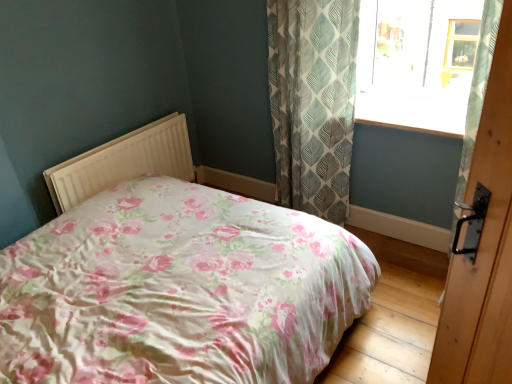
Question: Does transparent glass window at upper right have a lesser height compared to green leaf-patterned fabric curtain at upper right?

Choices:
 (A) yes
 (B) no

Answer: (A)

Question: From the image's perspective, would you say transparent glass window at upper right is positioned over green leaf-patterned fabric curtain at upper right?

Choices:
 (A) no
 (B) yes

Answer: (B)

Question: Does transparent glass window at upper right contain green leaf-patterned fabric curtain at upper right?

Choices:
 (A) yes
 (B) no

Answer: (B)

Question: From a real-world perspective, is transparent glass window at upper right located higher than green leaf-patterned fabric curtain at upper right?

Choices:
 (A) no
 (B) yes

Answer: (B)

Question: Is transparent glass window at upper right taller than green leaf-patterned fabric curtain at upper right?

Choices:
 (A) yes
 (B) no

Answer: (B)

Question: Considering their positions, is green leaf-patterned fabric curtain at upper right located in front of or behind transparent glass window at upper right?

Choices:
 (A) behind
 (B) front

Answer: (B)

Question: In terms of size, does green leaf-patterned fabric curtain at upper right appear bigger or smaller than transparent glass window at upper right?

Choices:
 (A) big
 (B) small

Answer: (A)

Question: Considering the positions of green leaf-patterned fabric curtain at upper right and transparent glass window at upper right in the image, is green leaf-patterned fabric curtain at upper right taller or shorter than transparent glass window at upper right?

Choices:
 (A) tall
 (B) short

Answer: (A)

Question: Is point coord(338,43) closer or farther from the camera than point coord(395,28)?

Choices:
 (A) farther
 (B) closer

Answer: (B)

Question: Visually, is floral fabric bed at center positioned to the left or to the right of green leaf-patterned fabric curtain at upper right?

Choices:
 (A) left
 (B) right

Answer: (A)

Question: In terms of size, does floral fabric bed at center appear bigger or smaller than green leaf-patterned fabric curtain at upper right?

Choices:
 (A) small
 (B) big

Answer: (B)

Question: From a real-world perspective, is floral fabric bed at center physically located above or below green leaf-patterned fabric curtain at upper right?

Choices:
 (A) above
 (B) below

Answer: (B)

Question: Considering the positions of floral fabric bed at center and green leaf-patterned fabric curtain at upper right in the image, is floral fabric bed at center wider or thinner than green leaf-patterned fabric curtain at upper right?

Choices:
 (A) thin
 (B) wide

Answer: (B)

Question: Is green leaf-patterned fabric curtain at upper right to the left or to the right of white plastic radiator at center in the image?

Choices:
 (A) right
 (B) left

Answer: (A)

Question: Is point coord(330,150) positioned closer to the camera than point coord(190,178)?

Choices:
 (A) closer
 (B) farther

Answer: (A)